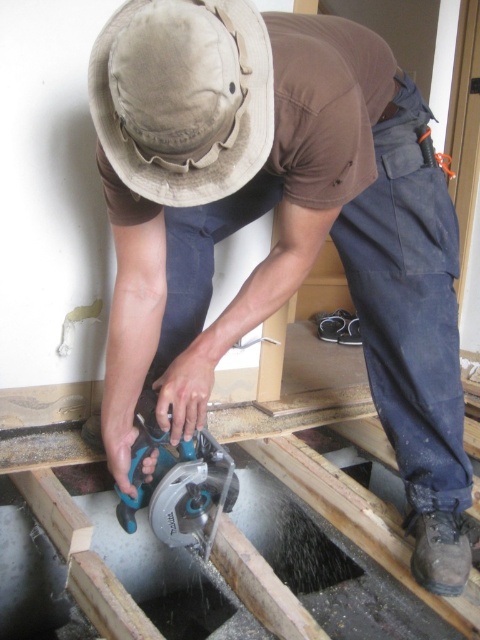
You are standing at the point labeled as point (115, 488) and want to move towards the point labeled as point (141, 150). Which direction should you face to walk towards it?

You should face north to walk towards point (141, 150) from point (115, 488).

You are a worker in the room and you want to place a tool on the floor near the tan fabric hat at upper center. Where should you place it?

The tan fabric hat at upper center is located at point (182, 97). You should place the tool near that coordinate on the floor.